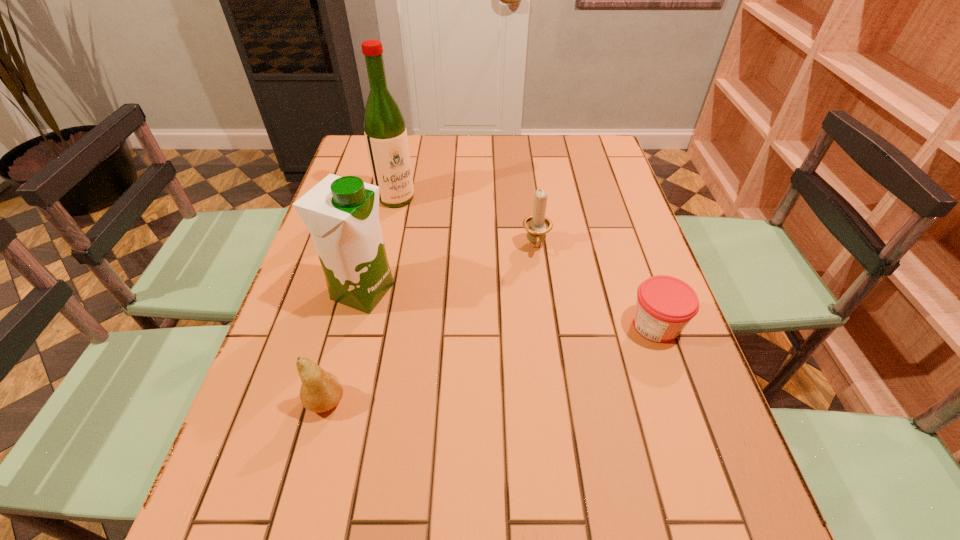
The image size is (960, 540). Find the location of `liquor that is positioned at the left edge`. liquor that is positioned at the left edge is located at coordinates (385, 132).

At what (x,y) coordinates should I click in order to perform the action: click on soya milk that is at the left edge. Please return your answer as a coordinate pair (x, y). This screenshot has height=540, width=960. Looking at the image, I should click on (341, 213).

Image resolution: width=960 pixels, height=540 pixels. I want to click on object that is at the right edge, so click(x=665, y=305).

Identify the location of free space at the far edge of the desktop. (420, 142).

Locate an element on the screen. This screenshot has height=540, width=960. vacant region at the left edge of the desktop is located at coordinates (275, 341).

Locate an element on the screen. This screenshot has height=540, width=960. free location at the right edge of the desktop is located at coordinates (675, 339).

You are a GUI agent. You are given a task and a screenshot of the screen. Output one action in this format:
    pyautogui.click(x=<x>, y=<y>)
    Task: Click on the free space at the far left corner
    
    Given the screenshot: What is the action you would take?
    pyautogui.click(x=368, y=159)

The image size is (960, 540). Identify the location of empty space between the rightmost object and the soya milk. (510, 308).

You are a GUI agent. You are given a task and a screenshot of the screen. Output one action in this format:
    pyautogui.click(x=<x>, y=<y>)
    Task: Click on the vacant area that lies between the tallest object and the jam
    This screenshot has width=960, height=540.
    Given the screenshot: What is the action you would take?
    pyautogui.click(x=526, y=261)

Locate an element on the screen. Image resolution: width=960 pixels, height=540 pixels. free space between the jam and the farthest object is located at coordinates (526, 261).